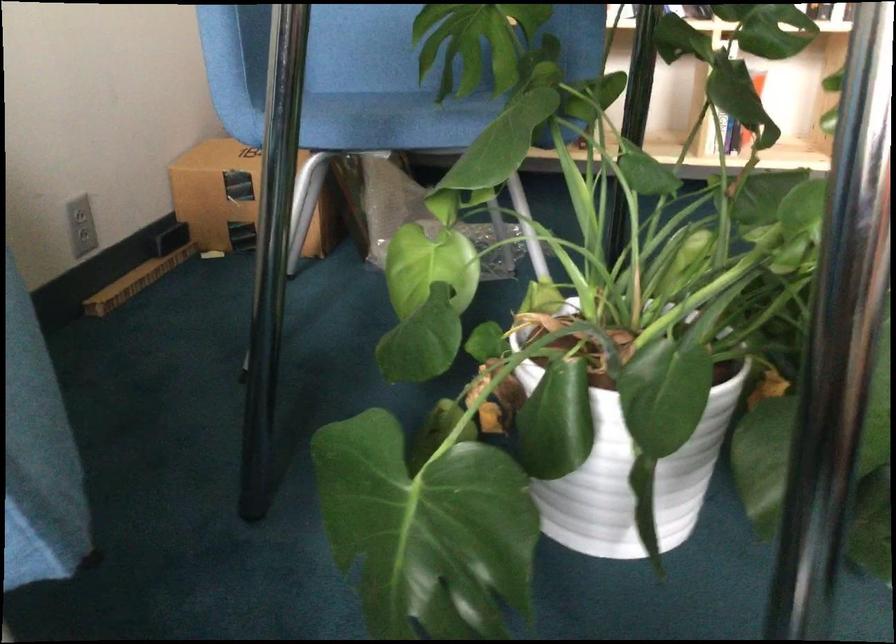
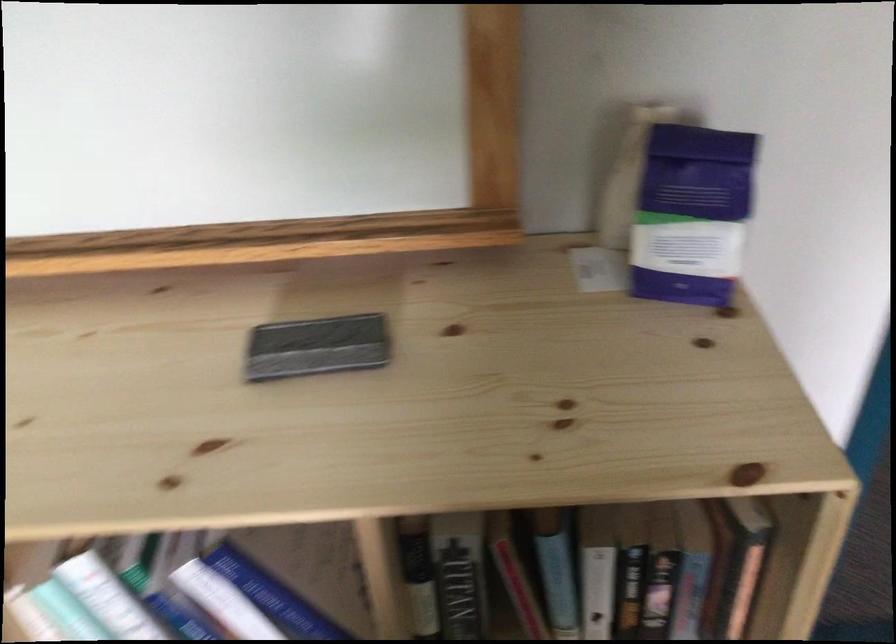
In a continuous first-person perspective shot, in which direction is the camera moving?

The cameraman moved toward right, forward.